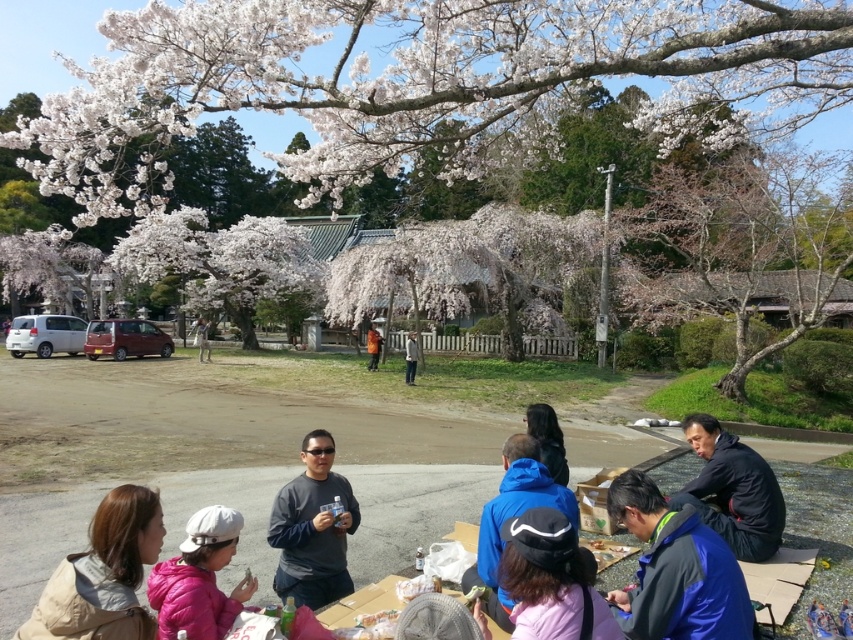
Question: Which point is farther to the camera?

Choices:
 (A) orange fabric jacket at center
 (B) khaki fabric jacket at center
 (C) black fabric jacket at lower right

Answer: (A)

Question: Which point appears closest to the camera in this image?

Choices:
 (A) (527, 426)
 (B) (207, 353)
 (C) (712, 115)

Answer: (A)

Question: Which point is closer to the camera?

Choices:
 (A) khaki fabric jacket at center
 (B) dark gray shirt at center

Answer: (B)

Question: From the image, what is the correct spatial relationship of pink matte jacket at lower left in relation to blue fleece jacket at lower center?

Choices:
 (A) left
 (B) right

Answer: (A)

Question: Does dark blue fabric cap at center have a larger size compared to blue fleece jacket at lower center?

Choices:
 (A) yes
 (B) no

Answer: (B)

Question: Can you confirm if black fabric jacket at lower right is positioned to the left of dark gray jacket at center?

Choices:
 (A) no
 (B) yes

Answer: (A)